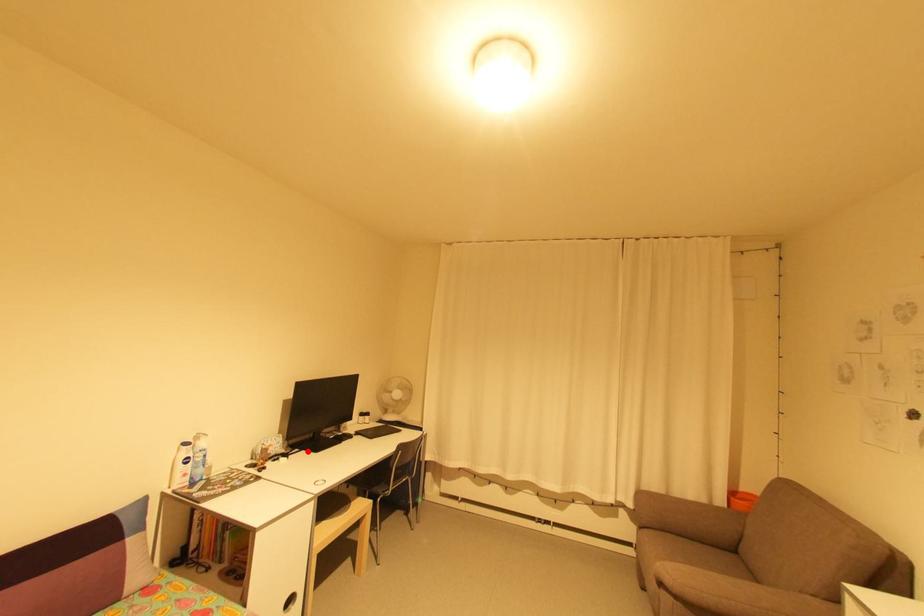
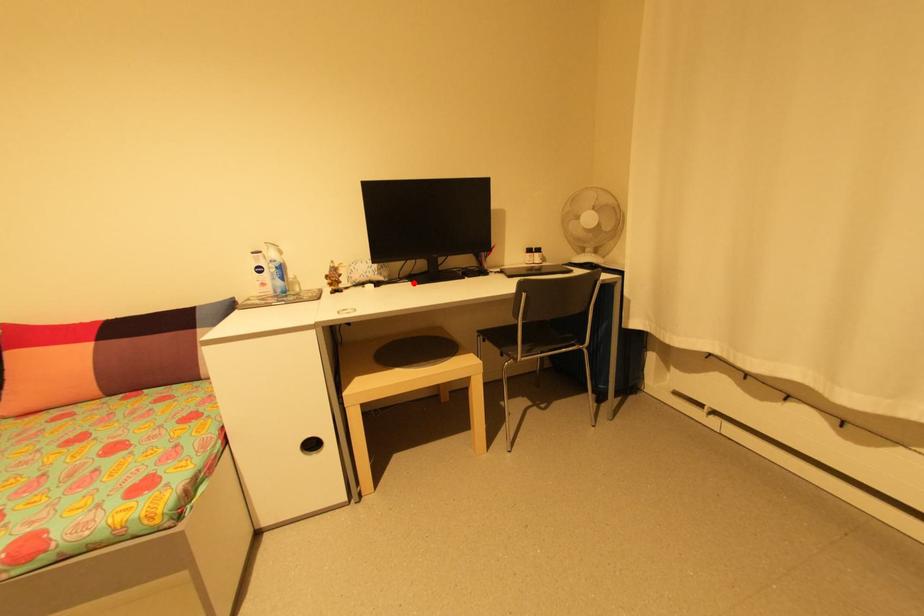
I am providing you with two images of the same scene from different viewpoints. A red point is marked on the first image and another point is marked on the second image. Do the highlighted points in image1 and image2 indicate the same real-world spot?

Yes